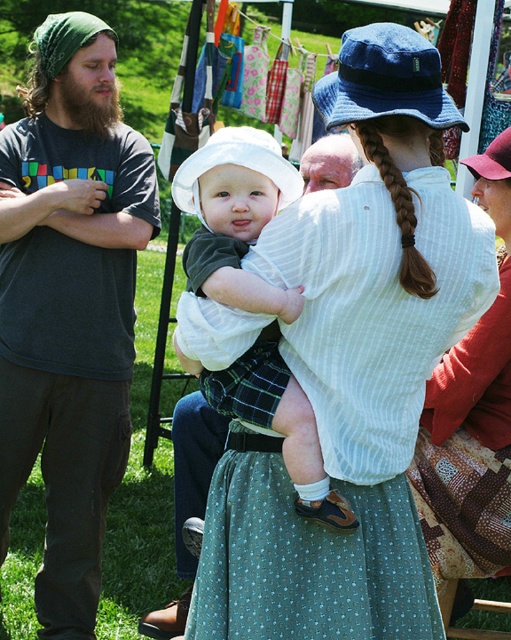
You are standing at point (476,344) and want to walk to point (131,161). Which direction should you face to move towards your destination?

You should face north because point (131,161) is behind point (476,344), meaning it is in the northern direction relative to your current position.